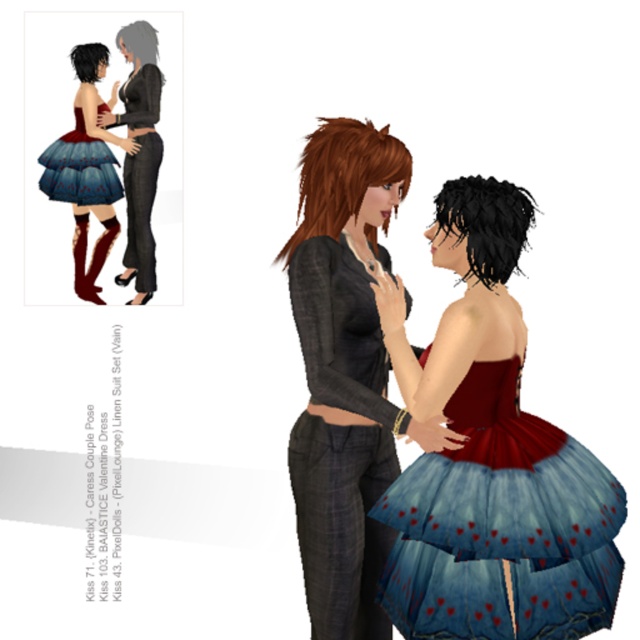
In the scene shown: Who is taller, matte blue tulle skirt at center or matte black dress at left?

matte black dress at left

Who is positioned more to the left, matte blue tulle skirt at center or matte black dress at left?

matte blue tulle skirt at center is more to the left.

Identify the location of matte blue tulle skirt at center. (88, 168).

Find the location of a particular element. The image size is (640, 640). matte black dress at left is located at coordinates (140, 152).

Is point (147, 259) closer to camera compared to point (99, 200)?

No, (147, 259) is behind (99, 200).

Which is in front, point (141, 99) or point (100, 202)?

Point (141, 99) is more forward.

I want to click on matte black dress at left, so click(140, 152).

Who is more forward, (x=604, y=566) or (x=499, y=461)?

Point (x=499, y=461)

Between matte black dress at center and blue tulle skirt with red hearts at lower right, which one is positioned lower?

blue tulle skirt with red hearts at lower right is lower down.

Is point (456, 202) closer to viewer compared to point (572, 576)?

Yes, point (456, 202) is closer to viewer.

This screenshot has height=640, width=640. I want to click on matte black dress at center, so click(x=456, y=410).